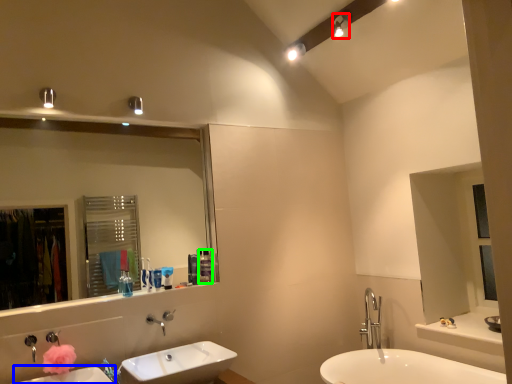
Question: Which is farther away from light fixture (highlighted by a red box)? sink (highlighted by a blue box) or toiletry (highlighted by a green box)?

Choices:
 (A) sink
 (B) toiletry

Answer: (A)